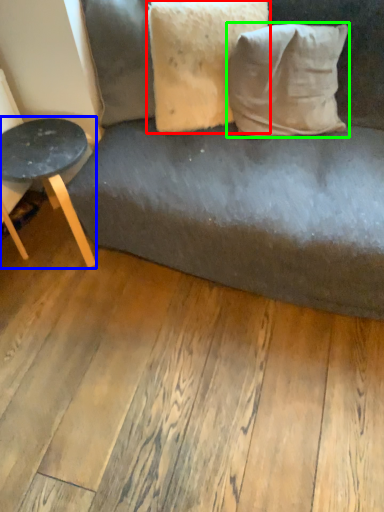
Question: Based on their relative distances, which object is nearer to pillow (highlighted by a red box)? Choose from table (highlighted by a blue box) and pillow (highlighted by a green box).

Choices:
 (A) table
 (B) pillow

Answer: (B)